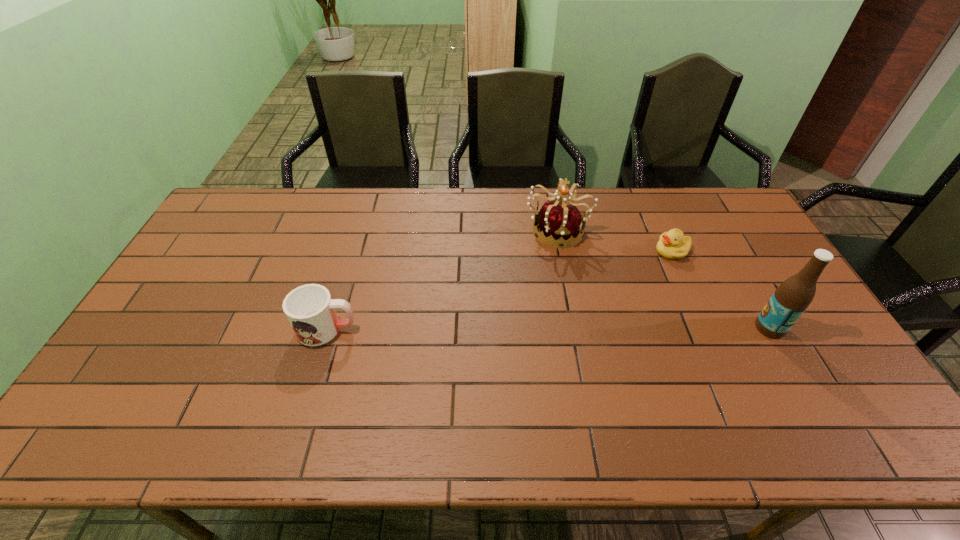
Image resolution: width=960 pixels, height=540 pixels. In order to click on vacant space located 0.300m on the front-facing side of the third shortest object in this screenshot , I will do `click(567, 322)`.

Locate an element on the screen. The image size is (960, 540). vacant space located on the front-facing side of the third shortest object is located at coordinates (564, 296).

Locate an element on the screen. The image size is (960, 540). vacant point located 0.270m on the front-facing side of the third shortest object is located at coordinates (566, 314).

Where is `vacant space situated on the front-facing side of the shortest object`? vacant space situated on the front-facing side of the shortest object is located at coordinates (580, 314).

Where is `vacant space located 0.180m on the front-facing side of the shortest object`? This screenshot has width=960, height=540. vacant space located 0.180m on the front-facing side of the shortest object is located at coordinates (625, 283).

At what (x,y) coordinates should I click in order to perform the action: click on free space located on the front-facing side of the shortest object. Please return your answer as a coordinate pair (x, y). The image size is (960, 540). Looking at the image, I should click on (640, 273).

Image resolution: width=960 pixels, height=540 pixels. Find the location of `object located at the far edge`. object located at the far edge is located at coordinates (563, 222).

Identify the location of object located in the right edge section of the desktop. (x=794, y=295).

Where is `free space at the far edge of the desktop`? The height and width of the screenshot is (540, 960). free space at the far edge of the desktop is located at coordinates (540, 205).

This screenshot has width=960, height=540. Find the location of `vacant space at the near edge of the desktop`. vacant space at the near edge of the desktop is located at coordinates (489, 396).